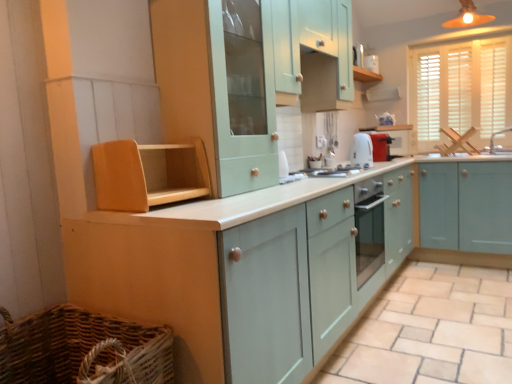
Question: From their relative heights in the image, would you say light beige tile at lower center is taller or shorter than white wood blinds at upper right?

Choices:
 (A) tall
 (B) short

Answer: (B)

Question: From the image's perspective, is light beige tile at lower center located above or below white wood blinds at upper right?

Choices:
 (A) below
 (B) above

Answer: (A)

Question: Which object is the farthest from the white wood blinds at upper right?

Choices:
 (A) metallic silver gas stove at center
 (B) mint green wood cabinet at upper center, the third cabinetry positioned from the right
 (C) matte red toaster at upper right, arranged as the third appliance when viewed from the front
 (D) white glossy toaster at center, the 1th appliance in the front-to-back sequence
 (E) matte orange light fixture at upper right

Answer: (B)

Question: Considering the real-world distances, which object is closest to the matte red toaster at upper right, which appears as the 1th appliance when viewed from the back?

Choices:
 (A) mint green wood cabinet at upper center, which is the fourth cabinetry from right to left
 (B) white ceramic sink at right
 (C) wooden shelf at left, the first cabinetry viewed from the left
 (D) mint green wood cabinet at upper center, the third cabinetry positioned from the right
 (E) white glossy toaster at center, the 1th appliance in the front-to-back sequence

Answer: (E)